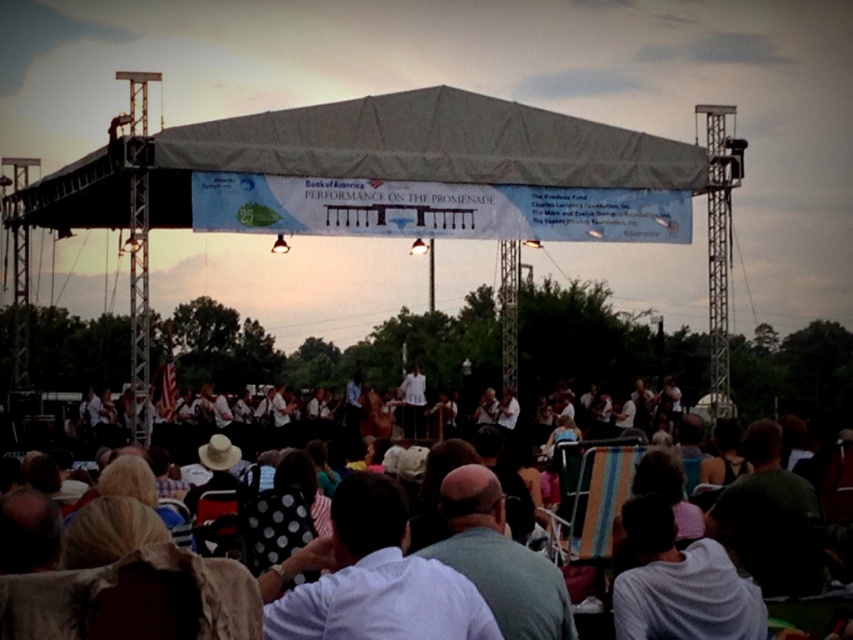
Question: Does gray fabric canopy at center have a lesser width compared to white polka dot shirt at center?

Choices:
 (A) no
 (B) yes

Answer: (A)

Question: Which point is closer to the camera taking this photo?

Choices:
 (A) (805, 483)
 (B) (386, 515)
 (C) (621, 561)

Answer: (B)

Question: Does gray fabric canopy at center have a lesser width compared to white cotton shirt at center?

Choices:
 (A) no
 (B) yes

Answer: (A)

Question: Among these points, which one is farthest from the camera?

Choices:
 (A) (120, 220)
 (B) (796, 508)
 (C) (405, 426)

Answer: (A)

Question: Estimate the real-world distances between objects in this image. Which object is closer to the dark green shirt at lower right?

Choices:
 (A) white fabric orchestra at center
 (B) white cotton shirt at center

Answer: (A)

Question: Is white polka dot shirt at center wider than dark green shirt at lower right?

Choices:
 (A) yes
 (B) no

Answer: (A)